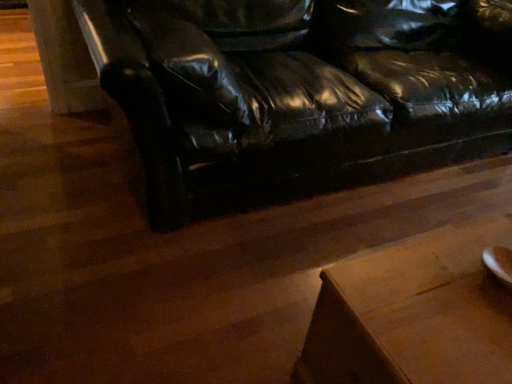
The image size is (512, 384). I want to click on blank space situated above wooden table at lower right (from a real-world perspective), so click(452, 294).